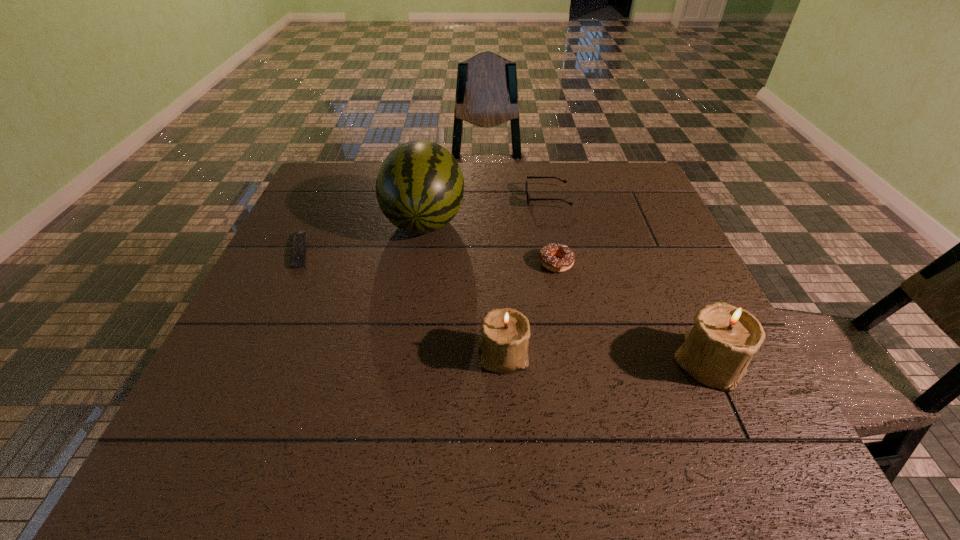
Find the location of `empty space between the right candle_holder and the doughnut`. empty space between the right candle_holder and the doughnut is located at coordinates (632, 313).

Where is `free space between the sunglasses and the doughnut`? Image resolution: width=960 pixels, height=540 pixels. free space between the sunglasses and the doughnut is located at coordinates (552, 231).

Where is `vacant space that's between the doughnut and the sunglasses`? vacant space that's between the doughnut and the sunglasses is located at coordinates (552, 231).

What are the coordinates of `free point between the remote control and the doughnut` in the screenshot? It's located at point(428,257).

Find the location of a particular element. free space between the shortest object and the fourth object from right to left is located at coordinates (402, 303).

The image size is (960, 540). Identify the location of object that can be found as the third closest to the remote control. (548, 254).

The width and height of the screenshot is (960, 540). In order to click on object that ranks as the third closest to the fifth shortest object in this screenshot , I will do `click(529, 199)`.

Find the location of a particular element. The image size is (960, 540). vacant region that satisfies the following two spatial constraints: 1. on the front side of the third tallest object; 2. on the left side of the second tallest object is located at coordinates (504, 362).

At what (x,y) coordinates should I click in order to perform the action: click on vacant area that satisfies the following two spatial constraints: 1. on the front lenses of the sunglasses; 2. at the stem end of the tallest object. Please return your answer as a coordinate pair (x, y). Image resolution: width=960 pixels, height=540 pixels. Looking at the image, I should click on (552, 221).

Find the location of a particular element. The height and width of the screenshot is (540, 960). vacant region that satisfies the following two spatial constraints: 1. on the back side of the doughnut; 2. on the left side of the third object from left to right is located at coordinates (499, 263).